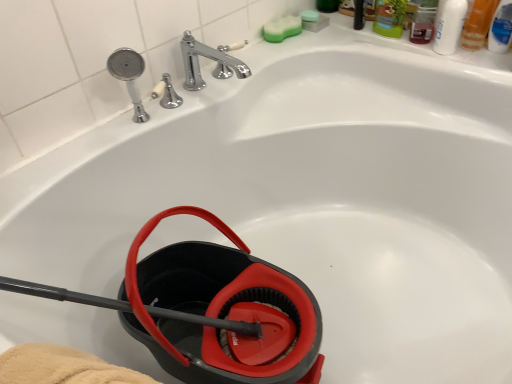
Question: Can you confirm if green sponge at upper center, which ranks as the 1th soap in right-to-left order, is thinner than black rubber garden hose at lower left?

Choices:
 (A) yes
 (B) no

Answer: (A)

Question: Is green sponge at upper center, the 2th soap from the left, surrounding black rubber garden hose at lower left?

Choices:
 (A) no
 (B) yes

Answer: (A)

Question: Is green sponge at upper center, which ranks as the 1th soap in right-to-left order, located outside black rubber garden hose at lower left?

Choices:
 (A) yes
 (B) no

Answer: (A)

Question: Is green sponge at upper center, which ranks as the 1th soap in right-to-left order, placed right next to black rubber garden hose at lower left?

Choices:
 (A) no
 (B) yes

Answer: (A)

Question: Is green sponge at upper center, the 2th soap from the left, aimed at black rubber garden hose at lower left?

Choices:
 (A) yes
 (B) no

Answer: (B)

Question: Is black rubber garden hose at lower left at the back of green sponge at upper center, the 2th soap from the left?

Choices:
 (A) yes
 (B) no

Answer: (B)

Question: Is green sponge at upper right, which is counted as the 2th soap, starting from the right, shorter than black rubber garden hose at lower left?

Choices:
 (A) no
 (B) yes

Answer: (B)

Question: Considering the relative sizes of green sponge at upper right, which is counted as the 2th soap, starting from the right, and black rubber garden hose at lower left in the image provided, is green sponge at upper right, which is counted as the 2th soap, starting from the right, taller than black rubber garden hose at lower left?

Choices:
 (A) yes
 (B) no

Answer: (B)

Question: Is green sponge at upper right, which is counted as the 2th soap, starting from the right, far from black rubber garden hose at lower left?

Choices:
 (A) yes
 (B) no

Answer: (B)

Question: Is green sponge at upper right, which is counted as the 2th soap, starting from the right, outside black rubber garden hose at lower left?

Choices:
 (A) no
 (B) yes

Answer: (B)

Question: Can you confirm if green sponge at upper right, which is counted as the 2th soap, starting from the right, is positioned to the left of black rubber garden hose at lower left?

Choices:
 (A) no
 (B) yes

Answer: (A)

Question: From a real-world perspective, is green sponge at upper right, positioned as the 1th soap in left-to-right order, located beneath black rubber garden hose at lower left?

Choices:
 (A) no
 (B) yes

Answer: (A)

Question: Can you confirm if translucent plastic mouthwash at upper right, the second mouthwash when ordered from left to right, is wider than white glossy bottle at upper right, acting as the third mouthwash starting from the right?

Choices:
 (A) yes
 (B) no

Answer: (A)